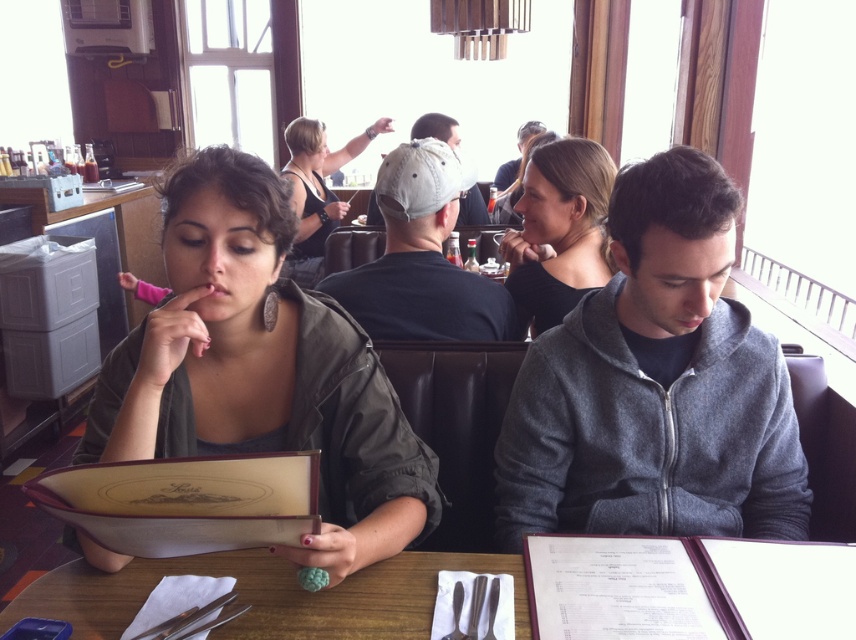
Question: Among these points, which one is farthest from the camera?

Choices:
 (A) (678, 609)
 (B) (295, 321)

Answer: (B)

Question: Can you confirm if wooden table at center is positioned to the right of matte black hair at upper center?

Choices:
 (A) no
 (B) yes

Answer: (A)

Question: Where is smooth black hair at center located in relation to white fabric cap at center in the image?

Choices:
 (A) left
 (B) right

Answer: (B)

Question: Which point is closer to the camera taking this photo?

Choices:
 (A) (313, 241)
 (B) (557, 396)

Answer: (B)

Question: Is matte green jacket at left wider than white fabric cap at center?

Choices:
 (A) yes
 (B) no

Answer: (A)

Question: Which point is closer to the camera taking this photo?

Choices:
 (A) (117, 616)
 (B) (521, 161)

Answer: (A)